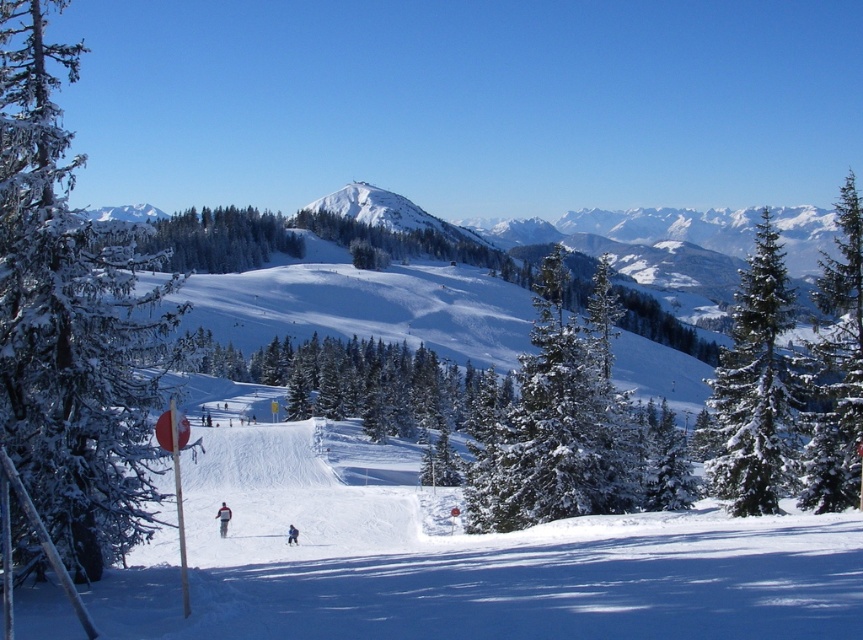
Is red fabric jacket at center shorter than blue fabric jacket at center?

In fact, red fabric jacket at center may be taller than blue fabric jacket at center.

Between red fabric jacket at center and blue fabric jacket at center, which one has less height?

blue fabric jacket at center

Is point (219, 536) behind point (295, 544)?

Yes.

Image resolution: width=863 pixels, height=640 pixels. Identify the location of red fabric jacket at center. (224, 518).

Based on the photo, does snow-covered evergreen tree at left appear over green matte tree at center?

Yes, snow-covered evergreen tree at left is above green matte tree at center.

Between snow-covered evergreen tree at left and green matte tree at center, which one is positioned lower?

green matte tree at center

Is point (65, 464) positioned after point (476, 481)?

No, (65, 464) is closer to viewer.

You are a GUI agent. You are given a task and a screenshot of the screen. Output one action in this format:
    pyautogui.click(x=<x>, y=<y>)
    Task: Click on the snow-covered evergreen tree at left
    
    Given the screenshot: What is the action you would take?
    pyautogui.click(x=68, y=321)

Is green snow-covered tree at right positioned at the back of green textured pine tree at right?

No, green snow-covered tree at right is in front of green textured pine tree at right.

Who is more forward, (761,388) or (843,502)?

Point (843,502) is more forward.

Which is behind, point (716, 429) or point (845, 481)?

Point (716, 429)

Locate an element on the screen. Image resolution: width=863 pixels, height=640 pixels. green snow-covered tree at right is located at coordinates (753, 388).